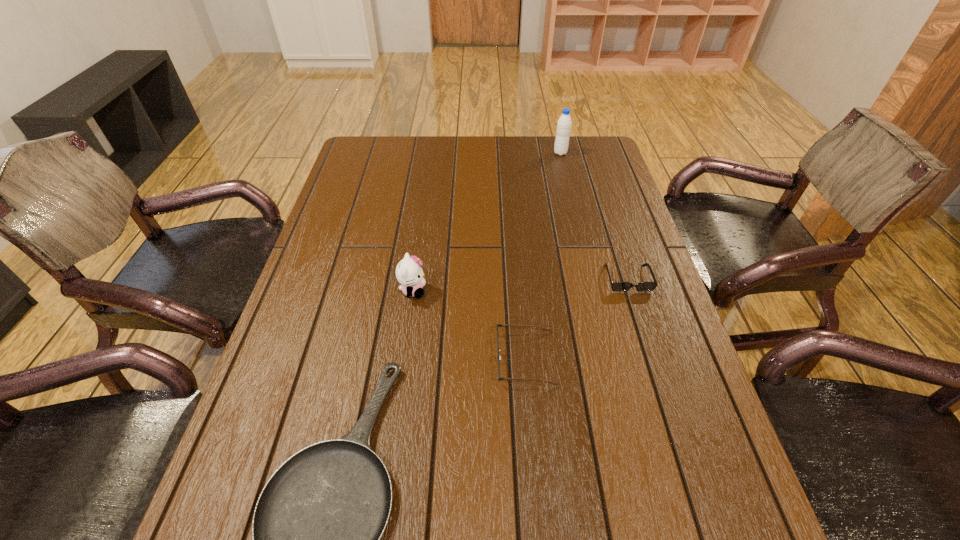
This screenshot has height=540, width=960. Find the location of `vacant space that satisfies the following two spatial constraints: 1. on the front-facing side of the sunglasses; 2. on the front-facing side of the second tallest object`. vacant space that satisfies the following two spatial constraints: 1. on the front-facing side of the sunglasses; 2. on the front-facing side of the second tallest object is located at coordinates (632, 291).